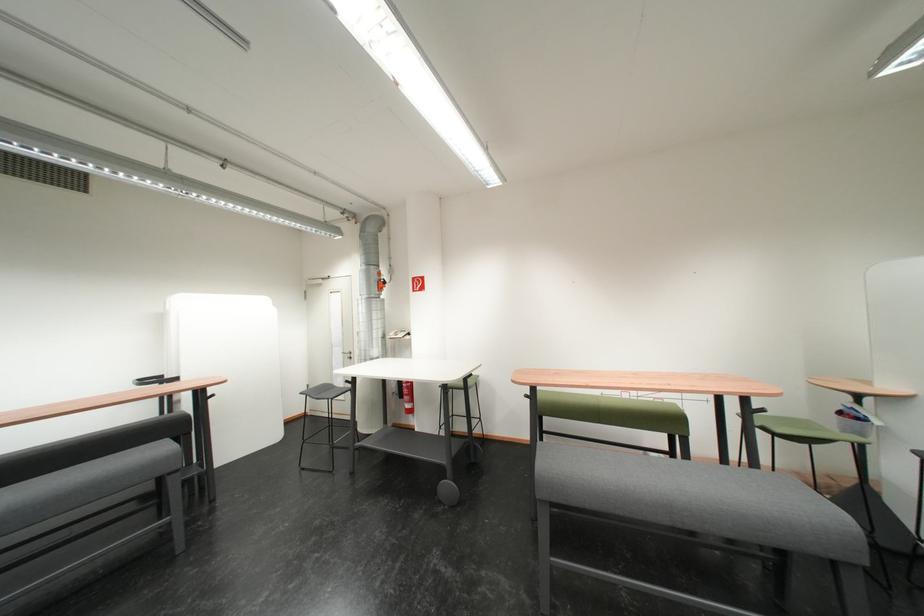
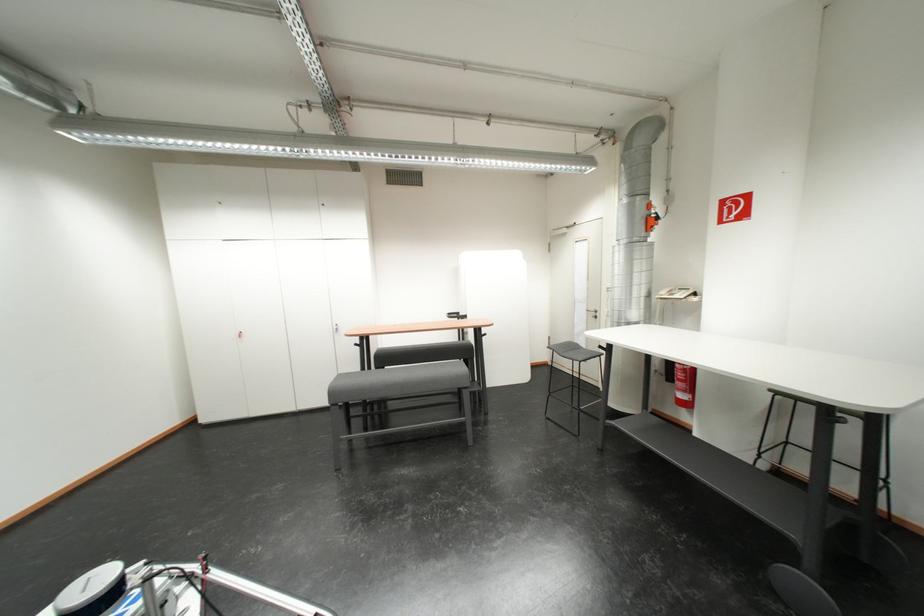
The point at (403,337) is marked in the first image. Where is the corresponding point in the second image?

(675, 296)